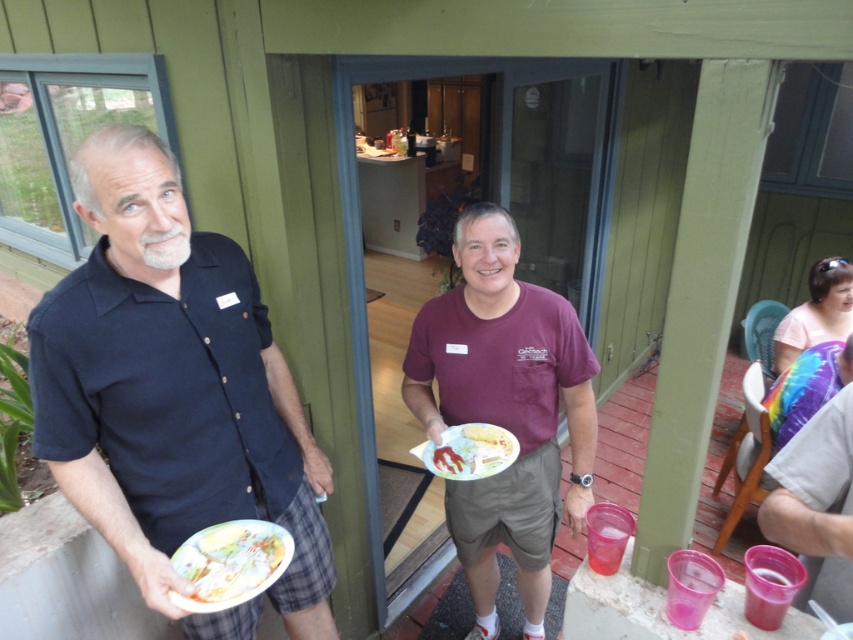
Does matte black shirt at left appear under white cotton shirt at right?

Incorrect, matte black shirt at left is not positioned below white cotton shirt at right.

Locate an element on the screen. matte black shirt at left is located at coordinates (173, 392).

Does point (129, 192) come in front of point (801, 436)?

Yes.

Locate an element on the screen. This screenshot has width=853, height=640. matte black shirt at left is located at coordinates (173, 392).

Does maroon fabric shirt at center appear over yellow matte plate at center?

No, maroon fabric shirt at center is not above yellow matte plate at center.

Does maroon fabric shirt at center have a smaller size compared to yellow matte plate at center?

No.

Find the location of a particular element. maroon fabric shirt at center is located at coordinates (503, 410).

Is point (172, 593) positioned in front of point (490, 467)?

Yes, it is in front of point (490, 467).

This screenshot has height=640, width=853. What are the coordinates of `printed paper plate at lower left` in the screenshot? It's located at (230, 563).

Who is more distant from viewer, [253,595] or [422,454]?

Point [422,454]

The width and height of the screenshot is (853, 640). Identify the location of printed paper plate at lower left. pos(230,563).